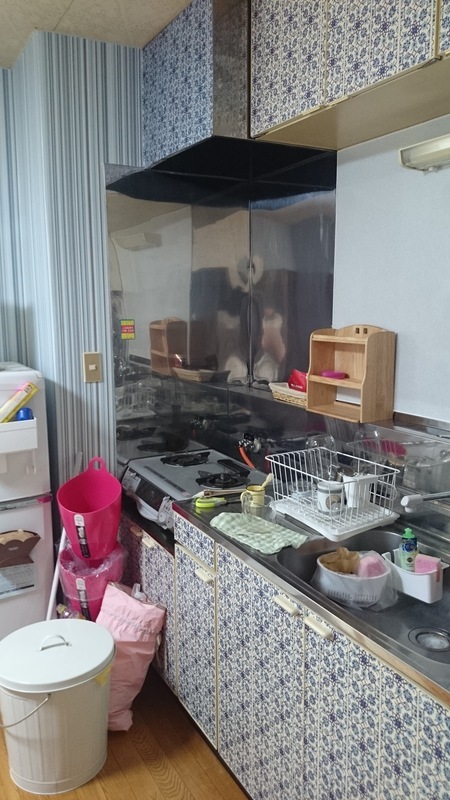
The image size is (450, 800). In order to click on cabinet doors in this screenshot , I will do `click(189, 130)`, `click(302, 93)`, `click(373, 69)`, `click(137, 556)`, `click(161, 570)`, `click(190, 588)`, `click(250, 642)`, `click(344, 693)`.